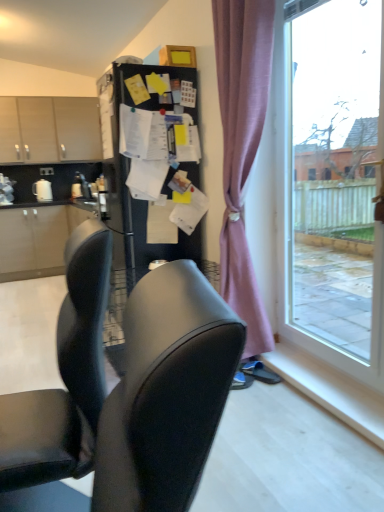
Question: Relative to transparent glass window at right, is white glossy paper towel dispenser at left in front or behind?

Choices:
 (A) behind
 (B) front

Answer: (A)

Question: Is white glossy paper towel dispenser at left to the left or to the right of transparent glass window at right in the image?

Choices:
 (A) left
 (B) right

Answer: (A)

Question: Estimate the real-world distances between objects in this image. Which object is farther from the blue suede shoes at lower right?

Choices:
 (A) transparent glass window at right
 (B) matte wood cabinets at upper left
 (C) pink fabric curtain at right
 (D) white glossy paper towel dispenser at left
 (E) black matte refrigerator at center

Answer: (B)

Question: Estimate the real-world distances between objects in this image. Which object is closer to the black fabric chair at center?

Choices:
 (A) transparent glass window at right
 (B) black matte refrigerator at center
 (C) blue suede shoes at lower right
 (D) white glossy paper towel dispenser at left
 (E) pink fabric curtain at right

Answer: (E)